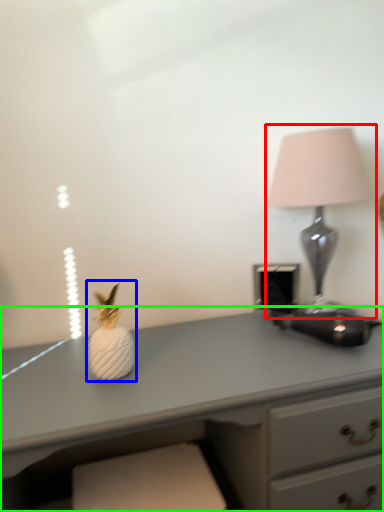
Question: Which object is positioned closest to lamp (highlighted by a red box)? Select from miniature (highlighted by a blue box) and desk (highlighted by a green box).

Choices:
 (A) miniature
 (B) desk

Answer: (B)